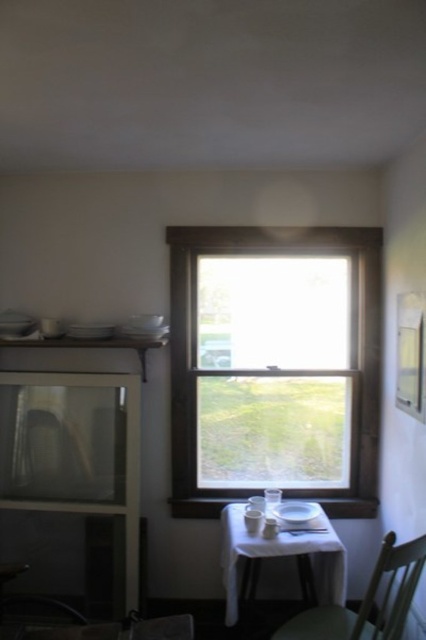
You are sitting in the green matte chair at lower right and want to place a book on the white matte table at center. In which direction should you move to reach the table?

You should move to the left to reach the white matte table at center because the green matte chair at lower right is positioned to the right of it.

You are standing in the room and want to move from the point at coordinates point (360, 300) to the point at coordinates point (229, 518). Which direction should you move to get closer to your destination?

To move from point (360, 300) to point (229, 518), you should move towards the upper right direction since point (229, 518) is located in the upper right relative to point (360, 300).